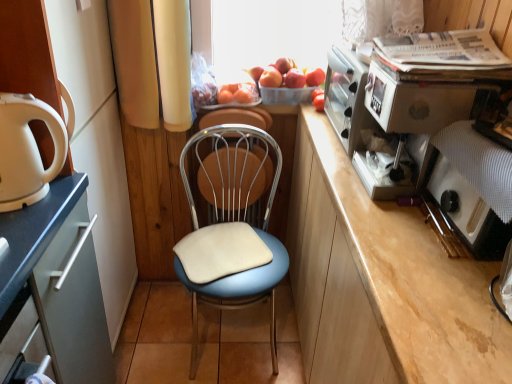
Question: From the image's perspective, is matte white cabinet at left beneath metallic silver coffee machine at upper right?

Choices:
 (A) yes
 (B) no

Answer: (A)

Question: Is matte white cabinet at left shorter than metallic silver coffee machine at upper right?

Choices:
 (A) no
 (B) yes

Answer: (A)

Question: Does matte white cabinet at left have a greater width compared to metallic silver coffee machine at upper right?

Choices:
 (A) yes
 (B) no

Answer: (A)

Question: From a real-world perspective, is matte white cabinet at left located beneath metallic silver coffee machine at upper right?

Choices:
 (A) yes
 (B) no

Answer: (A)

Question: Is the depth of matte white cabinet at left greater than that of metallic silver coffee machine at upper right?

Choices:
 (A) yes
 (B) no

Answer: (B)

Question: Does matte white cabinet at left turn towards metallic silver coffee machine at upper right?

Choices:
 (A) no
 (B) yes

Answer: (B)

Question: Is blue fabric-covered chair at center located outside metallic blue chair at center?

Choices:
 (A) yes
 (B) no

Answer: (A)

Question: Is blue fabric-covered chair at center far from metallic blue chair at center?

Choices:
 (A) yes
 (B) no

Answer: (B)

Question: Is blue fabric-covered chair at center looking in the opposite direction of metallic blue chair at center?

Choices:
 (A) yes
 (B) no

Answer: (A)

Question: Does blue fabric-covered chair at center turn towards metallic blue chair at center?

Choices:
 (A) yes
 (B) no

Answer: (B)

Question: Can you confirm if blue fabric-covered chair at center is thinner than metallic blue chair at center?

Choices:
 (A) yes
 (B) no

Answer: (B)

Question: Is blue fabric-covered chair at center to the left of metallic blue chair at center from the viewer's perspective?

Choices:
 (A) yes
 (B) no

Answer: (B)

Question: Could you tell me if smooth red apple at center, which is counted as the 2th apple, starting from the right, is turned towards red matte apple at upper center, placed as the second apple when sorted from left to right?

Choices:
 (A) yes
 (B) no

Answer: (B)